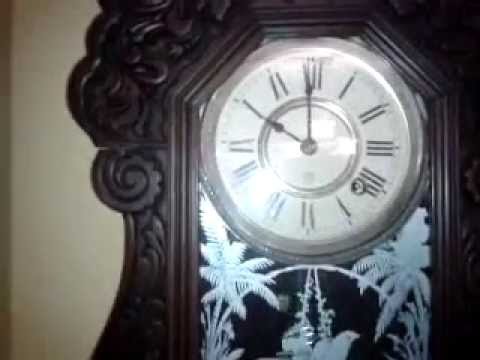
The height and width of the screenshot is (360, 480). Identify the location of wooden frame. (183, 145).